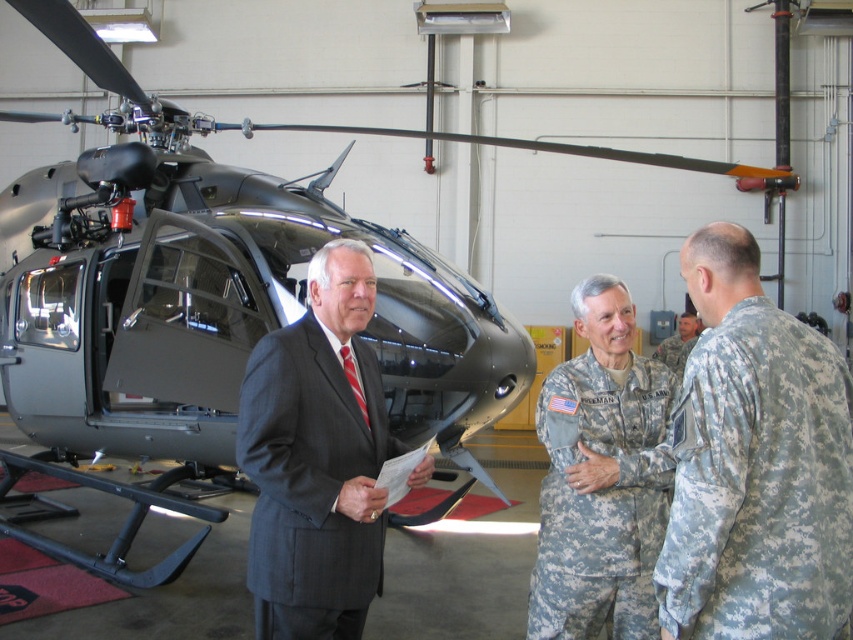
You are a military inspector tasked with ensuring proper equipment storage. You see a dark gray suit at center and a camouflage fabric uniform at center. Which item should you check first if you need to verify width specifications for storage compartments?

The dark gray suit at center might be wider than camouflage fabric uniform at center, so you should check the dark gray suit at center first to ensure it fits within the storage compartment dimensions.

You are a photographer positioned at the back of the hangar. You want to take a photo of both the camouflage fabric uniform at right and the camouflage fabric uniform at center so that both are fully visible. Which uniform should you position closer to the camera to ensure the shorter one isn

The camouflage fabric uniform at right is shorter than the camouflage fabric uniform at center. To ensure both are fully visible in the photo, position the camouflage fabric uniform at right closer to the camera so its shorter height is compensated by proximity, allowing it to appear taller in the frame compared to the taller uniform further back.